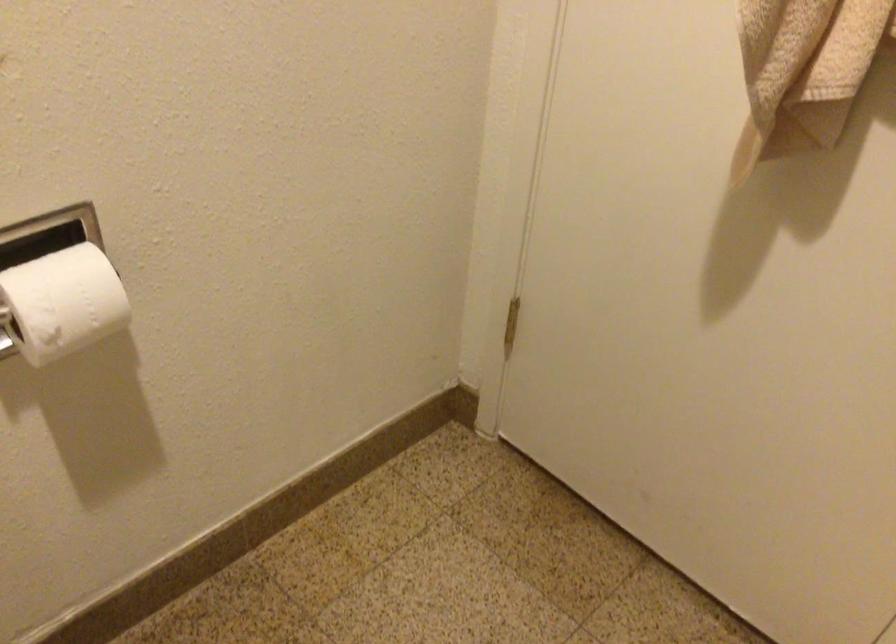
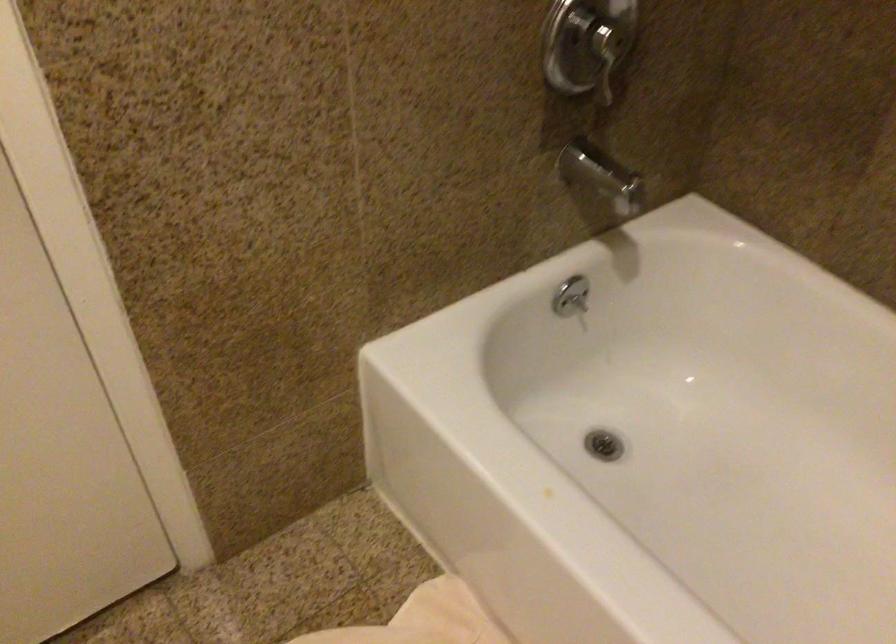
Based on the continuous images, in which direction is the camera rotating?

The camera's rotation is toward right-down.